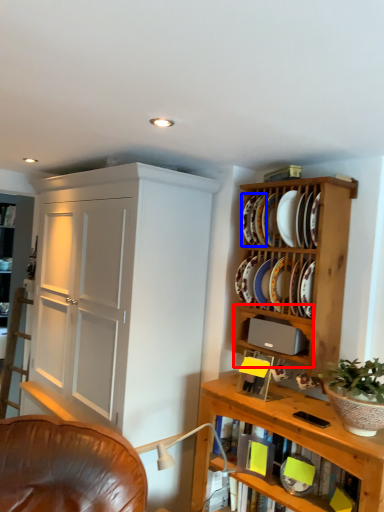
Question: Which point is closer to the camera, cabinet (highlighted by a red box) or platter (highlighted by a blue box)?

Choices:
 (A) cabinet
 (B) platter

Answer: (A)